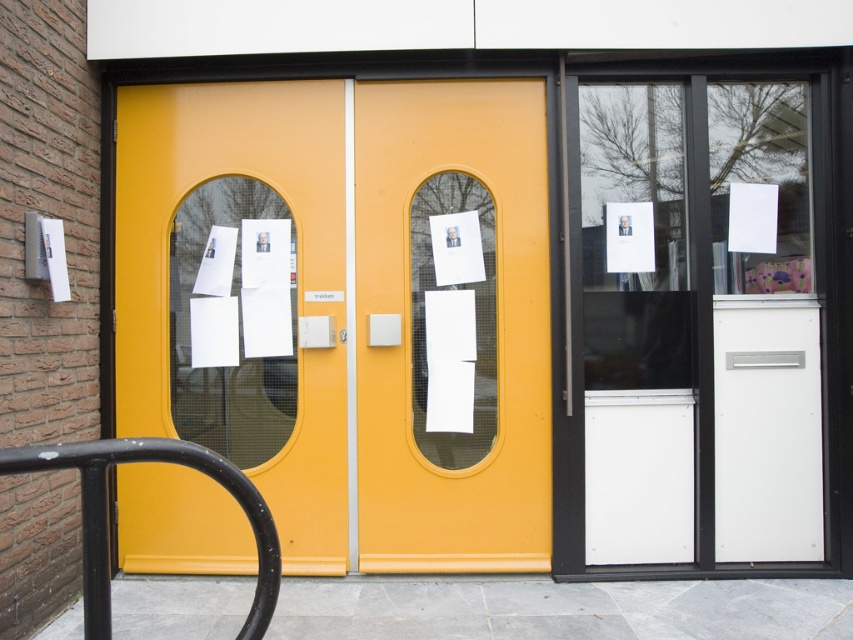
Between transparent glass door at right and matte yellow door at center, which one has less height?

Standing shorter between the two is matte yellow door at center.

The width and height of the screenshot is (853, 640). I want to click on transparent glass door at right, so click(711, 326).

Between point (642, 77) and point (393, 275), which one is positioned behind?

Positioned behind is point (642, 77).

The image size is (853, 640). What are the coordinates of `transparent glass door at right` in the screenshot? It's located at (711, 326).

Between matte yellow door at center and black metal/rail at lower left, which one is positioned higher?

matte yellow door at center

Is matte yellow door at center to the right of black metal/rail at lower left from the viewer's perspective?

Indeed, matte yellow door at center is positioned on the right side of black metal/rail at lower left.

Locate an element on the screen. This screenshot has height=640, width=853. matte yellow door at center is located at coordinates (410, 328).

Between transparent glass door at right and matte yellow glass window at center, which one is positioned higher?

Positioned higher is matte yellow glass window at center.

Is transparent glass door at right positioned behind matte yellow glass window at center?

No.

Measure the distance between point (781, 417) and camera.

A distance of 3.91 meters exists between point (781, 417) and camera.

The width and height of the screenshot is (853, 640). Find the location of `transparent glass door at right`. transparent glass door at right is located at coordinates coord(711,326).